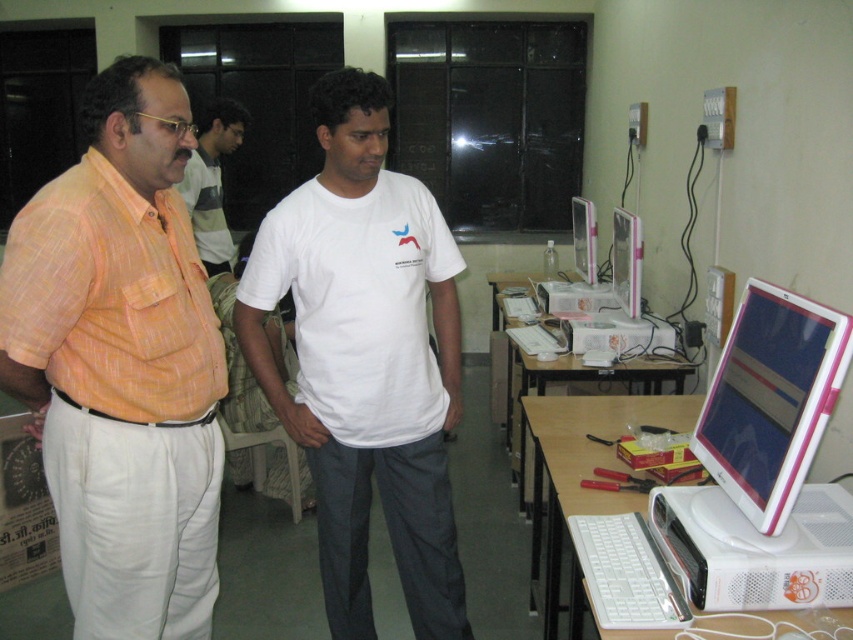
Question: Which object is closer to the camera taking this photo?

Choices:
 (A) pink glossy monitor at center
 (B) matte orange shirt at left
 (C) white plastic desktop at lower right

Answer: (C)

Question: Is white plastic monitor at center right positioned in front of pink glossy monitor at center?

Choices:
 (A) yes
 (B) no

Answer: (A)

Question: Can you confirm if matte orange shirt at left is bigger than white glossy monitor at center?

Choices:
 (A) no
 (B) yes

Answer: (B)

Question: Can you confirm if white glossy monitor at center is wider than pink glossy monitor at center?

Choices:
 (A) yes
 (B) no

Answer: (A)

Question: Which point is closer to the camera taking this photo?

Choices:
 (A) (306, 273)
 (B) (636, 296)
 (C) (199, 244)
 (D) (813, 570)

Answer: (D)

Question: Based on their relative distances, which object is nearer to the pink plastic monitor at center right?

Choices:
 (A) white glossy monitor at center
 (B) white cotton t-shirt at center
 (C) orange cotton shirt at left

Answer: (B)